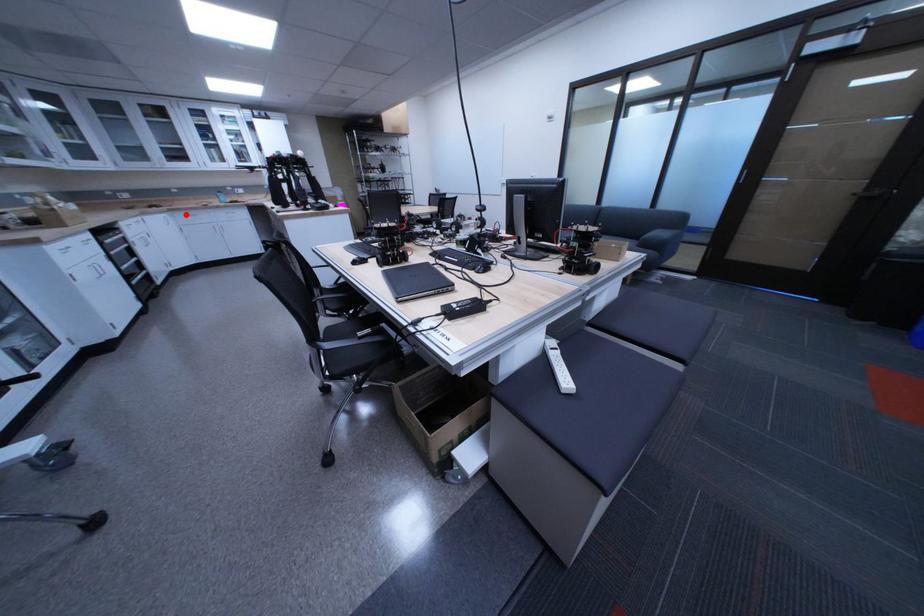
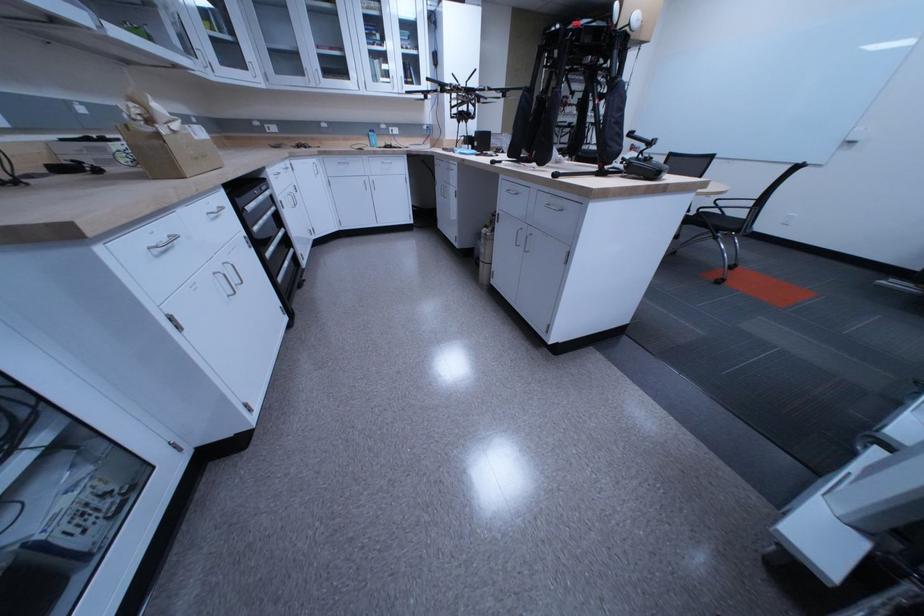
Where in the second image is the point corresponding to the highlighted location from the first image?

(335, 159)